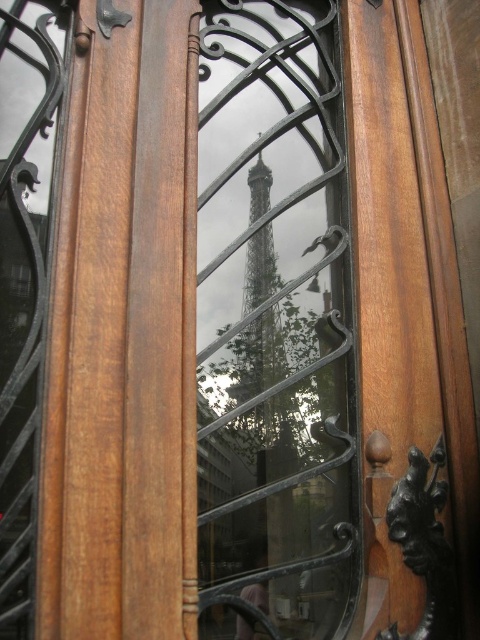
From the picture: You are an interior designer trying to decide if a decorative Eiffel Tower model can fit through the transparent glass window at center. The model is the same size as the metallic silver eiffel tower at center. Can it pass through?

The transparent glass window at center might be wider than metallic silver eiffel tower at center, so the model might fit through the window.

Looking at this image, you are standing inside a building and looking at the wooden door with intricate metalwork. You notice the transparent glass window at center and the metallic silver Eiffel Tower at center. Which object is positioned higher on the door?

The transparent glass window at center is positioned higher than the metallic silver Eiffel Tower at center according to the description.

You are standing inside a building and see the transparent glass window at center and the metallic silver eiffel tower at center. Which object is closer to you?

The transparent glass window at center is closer to you because it is in front of the metallic silver eiffel tower at center.